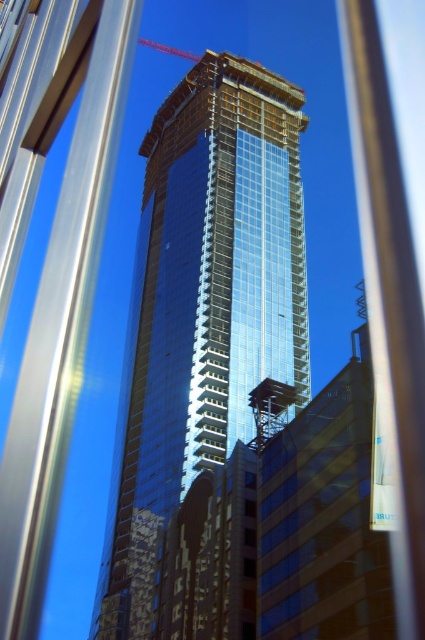
Question: Which point is farther to the camera?

Choices:
 (A) shiny glass tower at center
 (B) metallic red crane at upper center

Answer: (B)

Question: Is the position of shiny glass tower at center less distant than that of metallic red crane at upper center?

Choices:
 (A) no
 (B) yes

Answer: (B)

Question: Among these points, which one is nearest to the camera?

Choices:
 (A) (200, 60)
 (B) (146, 38)

Answer: (A)

Question: Is shiny glass tower at center wider than metallic red crane at upper center?

Choices:
 (A) no
 (B) yes

Answer: (B)

Question: Does shiny glass tower at center have a lesser width compared to metallic red crane at upper center?

Choices:
 (A) no
 (B) yes

Answer: (A)